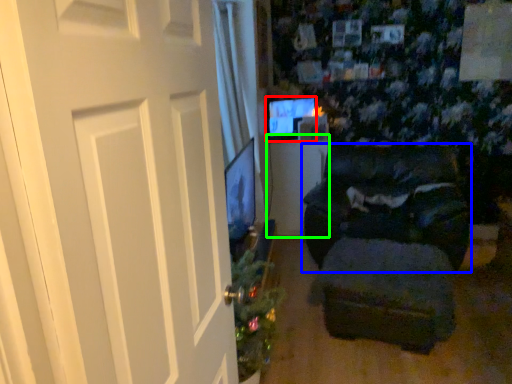
Question: Which is farther away from computer monitor (highlighted by a red box)? furniture (highlighted by a blue box) or table (highlighted by a green box)?

Choices:
 (A) furniture
 (B) table

Answer: (A)